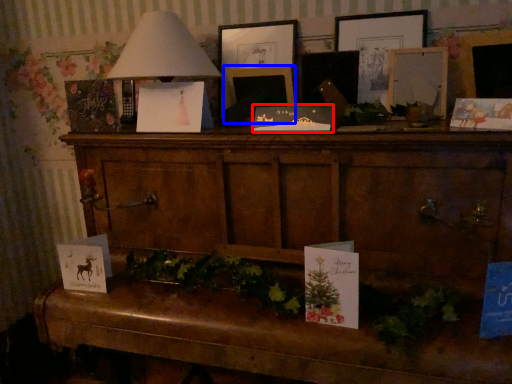
Question: Which of the following is the closest to the observer, christmas card (highlighted by a red box) or picture frame (highlighted by a blue box)?

Choices:
 (A) christmas card
 (B) picture frame

Answer: (A)